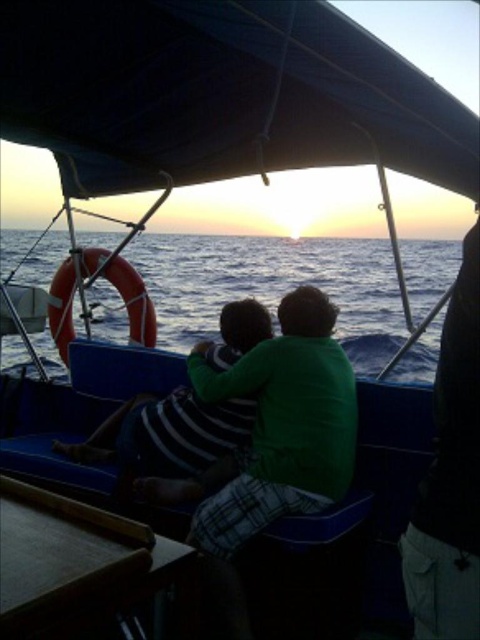
Question: Is blue water at center in front of green cotton shirt at center?

Choices:
 (A) yes
 (B) no

Answer: (B)

Question: Which of the following is the closest to the observer?

Choices:
 (A) green fabric shirt at right
 (B) green cotton shirt at center
 (C) blue water at center

Answer: (A)

Question: Estimate the real-world distances between objects in this image. Which object is closer to the green cotton shirt at center?

Choices:
 (A) green fabric shirt at right
 (B) blue water at center

Answer: (A)

Question: Considering the relative positions of blue water at center and green cotton shirt at center in the image provided, where is blue water at center located with respect to green cotton shirt at center?

Choices:
 (A) below
 (B) above

Answer: (B)

Question: In this image, where is blue water at center located relative to green cotton shirt at center?

Choices:
 (A) right
 (B) left

Answer: (A)

Question: Estimate the real-world distances between objects in this image. Which object is farther from the green fabric shirt at right?

Choices:
 (A) green cotton shirt at center
 (B) blue water at center

Answer: (B)